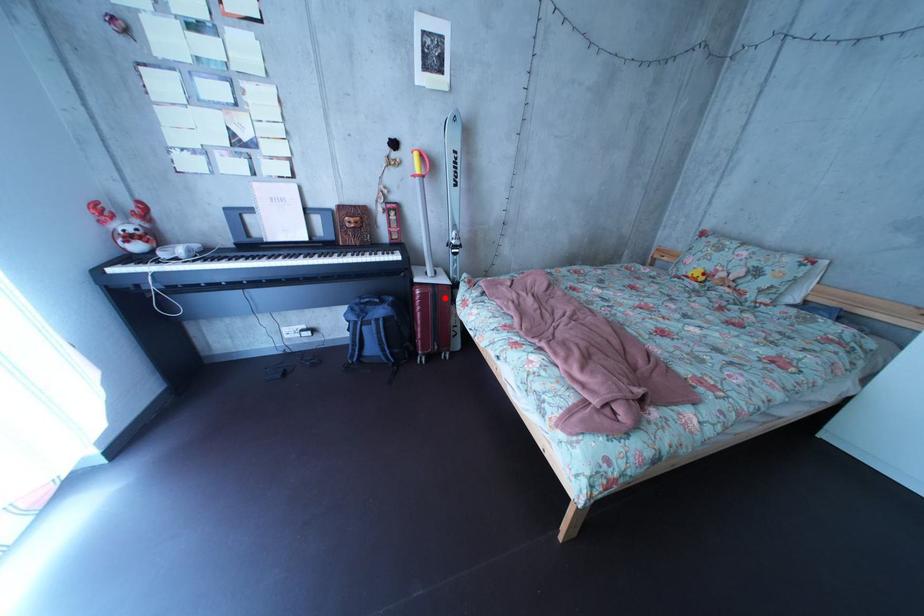
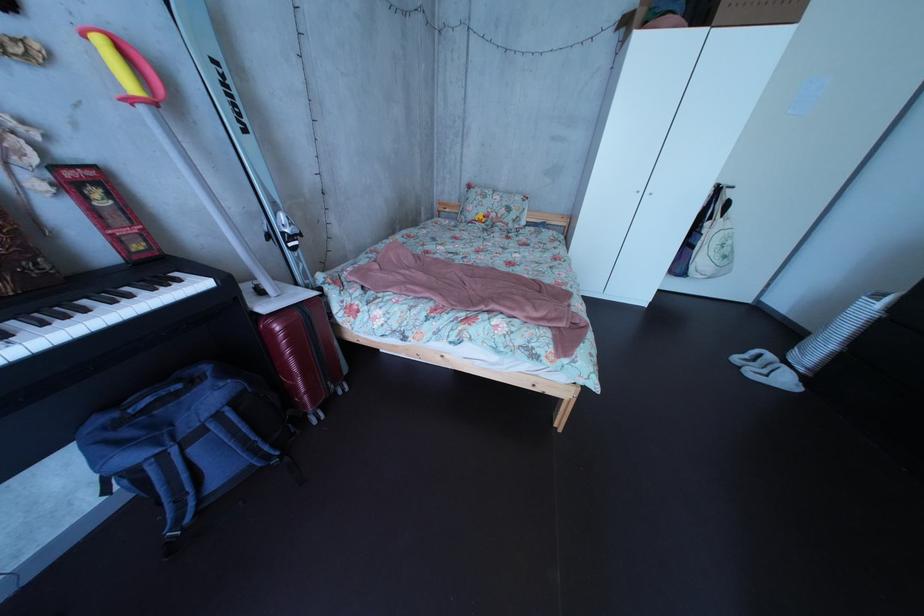
The point at the highlighted location is marked in the first image. Where is the corresponding point in the second image?

(311, 322)